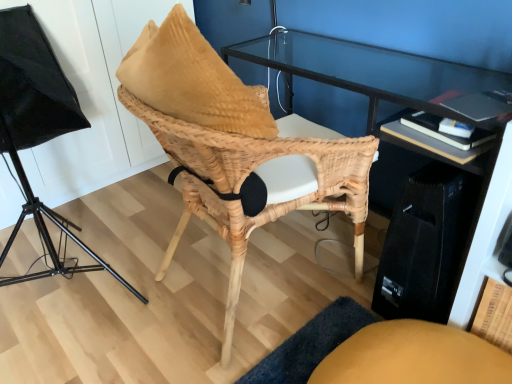
Question: In terms of width, does black fabric lampshade at left look wider or thinner when compared to natural woven chair at center?

Choices:
 (A) thin
 (B) wide

Answer: (B)

Question: Considering the positions of point (142, 299) and point (175, 104), is point (142, 299) closer or farther from the camera than point (175, 104)?

Choices:
 (A) closer
 (B) farther

Answer: (B)

Question: In the image, is black fabric lampshade at left positioned in front of or behind natural woven chair at center?

Choices:
 (A) front
 (B) behind

Answer: (A)

Question: Is natural woven chair at center to the left or to the right of black fabric lampshade at left in the image?

Choices:
 (A) right
 (B) left

Answer: (A)

Question: Considering the positions of natural woven chair at center and black fabric lampshade at left in the image, is natural woven chair at center bigger or smaller than black fabric lampshade at left?

Choices:
 (A) small
 (B) big

Answer: (A)

Question: Considering the positions of natural woven chair at center and black fabric lampshade at left in the image, is natural woven chair at center taller or shorter than black fabric lampshade at left?

Choices:
 (A) short
 (B) tall

Answer: (A)

Question: Choose the correct answer: Is natural woven chair at center inside black fabric lampshade at left or outside it?

Choices:
 (A) outside
 (B) inside

Answer: (A)